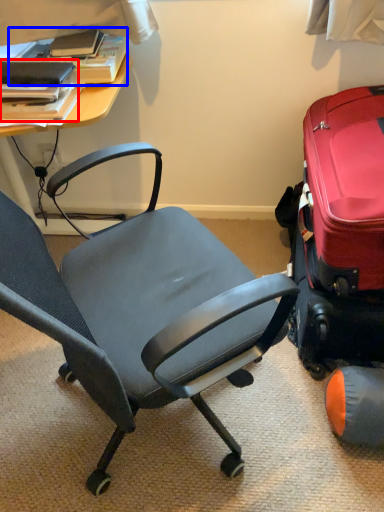
Question: Which of the following is the closest to the observer, book (highlighted by a red box) or book (highlighted by a blue box)?

Choices:
 (A) book
 (B) book

Answer: (A)